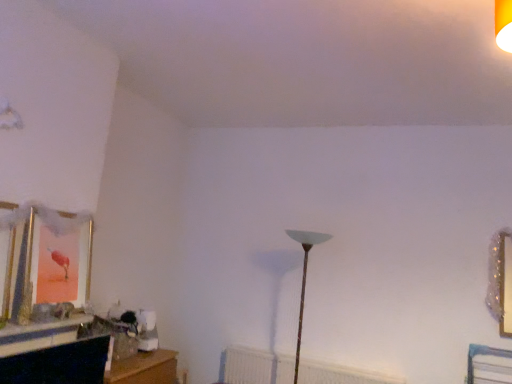
In order to click on translucent glass lamp at center in this screenshot , I will do `click(304, 278)`.

The width and height of the screenshot is (512, 384). Describe the element at coordinates (304, 278) in the screenshot. I see `translucent glass lamp at center` at that location.

In order to face white textured radiator at center, should I rotate leftwards or rightwards?

A 7.071 degree turn to the right will do.

This screenshot has width=512, height=384. Describe the element at coordinates (255, 366) in the screenshot. I see `white textured radiator at center` at that location.

At what (x,y) coordinates should I click in order to perform the action: click on white textured radiator at center. Please return your answer as a coordinate pair (x, y). The height and width of the screenshot is (384, 512). Looking at the image, I should click on (255, 366).

Find the location of a particular element. This screenshot has height=384, width=512. translucent glass lamp at center is located at coordinates (304, 278).

Is white textured radiator at center at the left side of translucent glass lamp at center?

No, white textured radiator at center is not to the left of translucent glass lamp at center.

Does white textured radiator at center come behind translucent glass lamp at center?

Yes, it is behind translucent glass lamp at center.

Which is farther from the camera, [334,365] or [296,374]?

The point [334,365] is farther.

From the image's perspective, is white textured radiator at center located above or below translucent glass lamp at center?

Clearly, from the image's perspective, white textured radiator at center is below translucent glass lamp at center.

From a real-world perspective, is white textured radiator at center positioned under translucent glass lamp at center based on gravity?

Yes, from a real-world perspective, white textured radiator at center is below translucent glass lamp at center.

Looking at their sizes, would you say white textured radiator at center is wider or thinner than translucent glass lamp at center?

Clearly, white textured radiator at center has less width compared to translucent glass lamp at center.

Between white textured radiator at center and translucent glass lamp at center, which one has less height?

white textured radiator at center is shorter.

Is white textured radiator at center bigger or smaller than translucent glass lamp at center?

white textured radiator at center is smaller than translucent glass lamp at center.

Would you say white textured radiator at center is inside or outside translucent glass lamp at center?

white textured radiator at center is outside translucent glass lamp at center.

Is white textured radiator at center beside translucent glass lamp at center?

No, white textured radiator at center is not beside translucent glass lamp at center.

From the picture: Is white textured radiator at center oriented away from translucent glass lamp at center?

No, white textured radiator at center is not facing away from translucent glass lamp at center.

Can you tell me how much white textured radiator at center and translucent glass lamp at center differ in facing direction?

1.43 degrees.

Where is `lamp in front of the white textured radiator at center`? This screenshot has width=512, height=384. lamp in front of the white textured radiator at center is located at coordinates (304, 278).

Considering the positions of objects translucent glass lamp at center and white textured radiator at center in the image provided, who is more to the left, translucent glass lamp at center or white textured radiator at center?

From the viewer's perspective, translucent glass lamp at center appears more on the left side.

Considering the positions of objects translucent glass lamp at center and white textured radiator at center in the image provided, who is behind, translucent glass lamp at center or white textured radiator at center?

white textured radiator at center is further away from the camera.

Between point (304, 270) and point (249, 380), which one is positioned behind?

Positioned behind is point (249, 380).

From the image's perspective, is translucent glass lamp at center above white textured radiator at center?

Indeed, from the image's perspective, translucent glass lamp at center is shown above white textured radiator at center.

From a real-world perspective, which object rests below the other?

white textured radiator at center.

Is translucent glass lamp at center wider than white textured radiator at center?

Indeed, translucent glass lamp at center has a greater width compared to white textured radiator at center.

Is translucent glass lamp at center taller than white textured radiator at center?

Indeed, translucent glass lamp at center has a greater height compared to white textured radiator at center.

Can you confirm if translucent glass lamp at center is smaller than white textured radiator at center?

No, translucent glass lamp at center is not smaller than white textured radiator at center.

Is translucent glass lamp at center completely or partially outside of white textured radiator at center?

translucent glass lamp at center lies outside white textured radiator at center's area.

Is translucent glass lamp at center directly adjacent to white textured radiator at center?

No.

Is translucent glass lamp at center oriented towards white textured radiator at center?

No, translucent glass lamp at center is not turned towards white textured radiator at center.

What's the angular difference between translucent glass lamp at center and white textured radiator at center's facing directions?

1.43 degrees separate the facing orientations of translucent glass lamp at center and white textured radiator at center.

Where is `lamp above the white textured radiator at center (from the image's perspective)`? The height and width of the screenshot is (384, 512). lamp above the white textured radiator at center (from the image's perspective) is located at coordinates (304, 278).

Image resolution: width=512 pixels, height=384 pixels. What are the coordinates of `radiator on the right of translucent glass lamp at center` in the screenshot? It's located at coord(255,366).

Find the location of a particular element. The width and height of the screenshot is (512, 384). lamp above the white textured radiator at center (from a real-world perspective) is located at coordinates (304, 278).